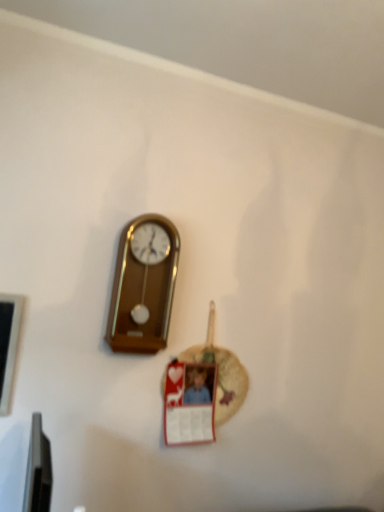
This screenshot has width=384, height=512. What do you see at coordinates (144, 285) in the screenshot?
I see `wooden wall clock at center` at bounding box center [144, 285].

At what (x,y) coordinates should I click in order to perform the action: click on wooden wall clock at center. Please return your answer as a coordinate pair (x, y). This screenshot has width=384, height=512. Looking at the image, I should click on (144, 285).

I want to click on wooden wall clock at center, so click(x=144, y=285).